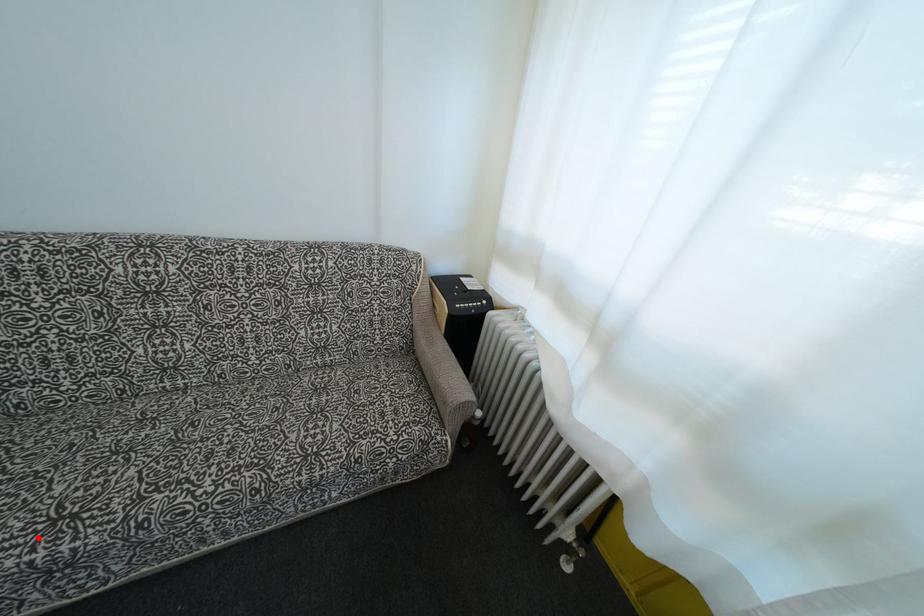
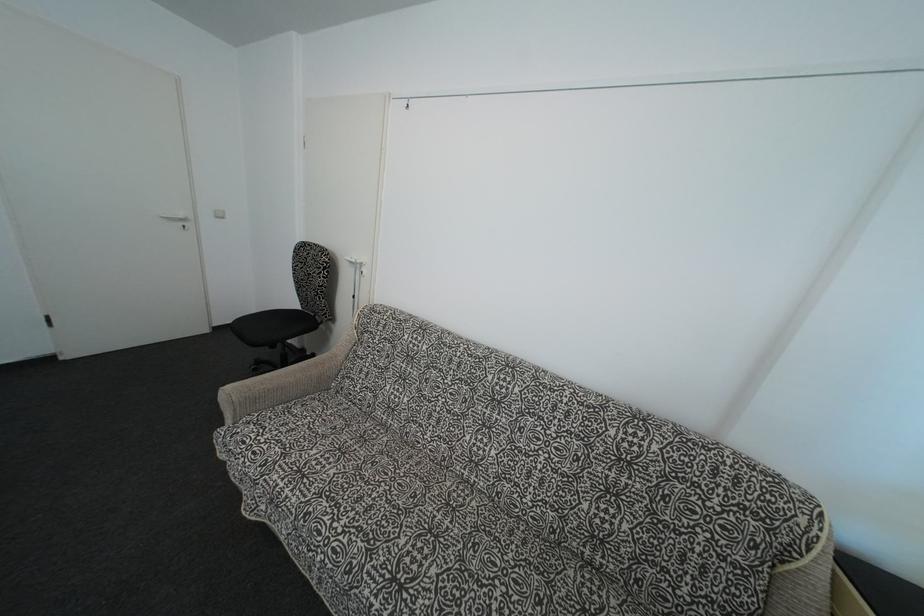
Locate, in the second image, the point that corresponds to the highlighted location in the first image.

(387, 583)